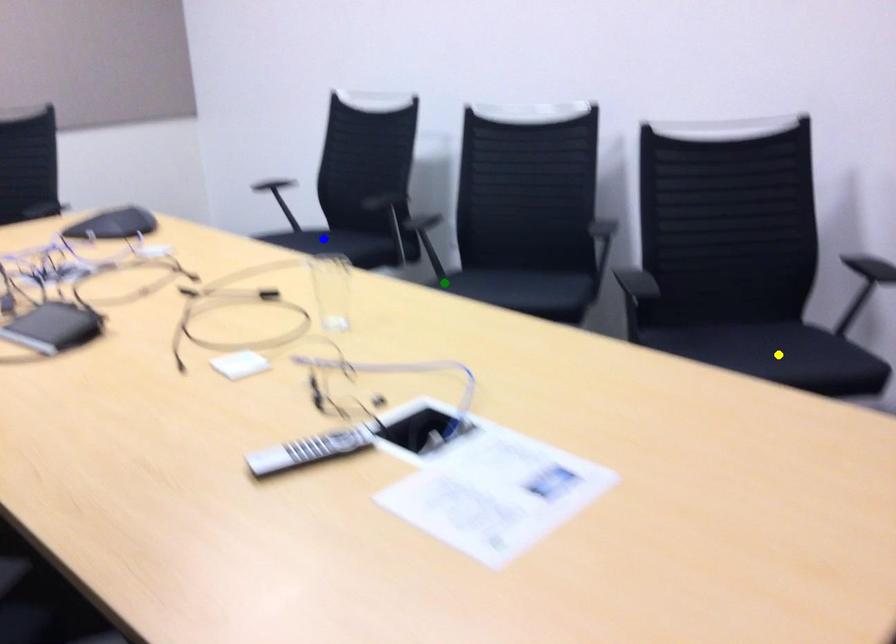
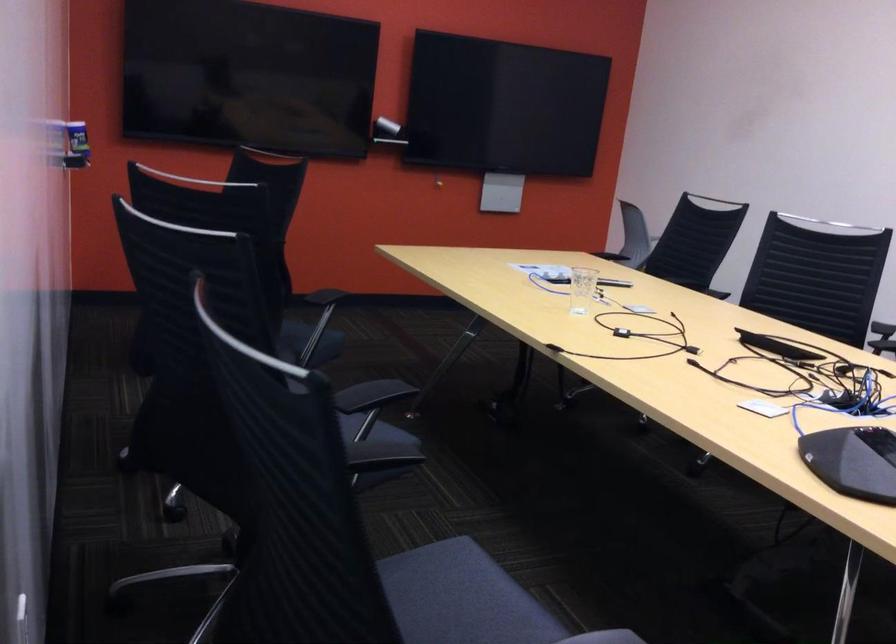
I am providing you with two images of the same scene from different viewpoints. Three points are marked in image1. Which point corresponds to a part or object that is occluded in image2?In image1, three points are marked. Which of them correspond to a part or object that is occluded in image2?Among the three points shown in image1, which one corresponds to a part or object that is no longer visible due to occlusion in image2?

Invisible in image2: yellow point.